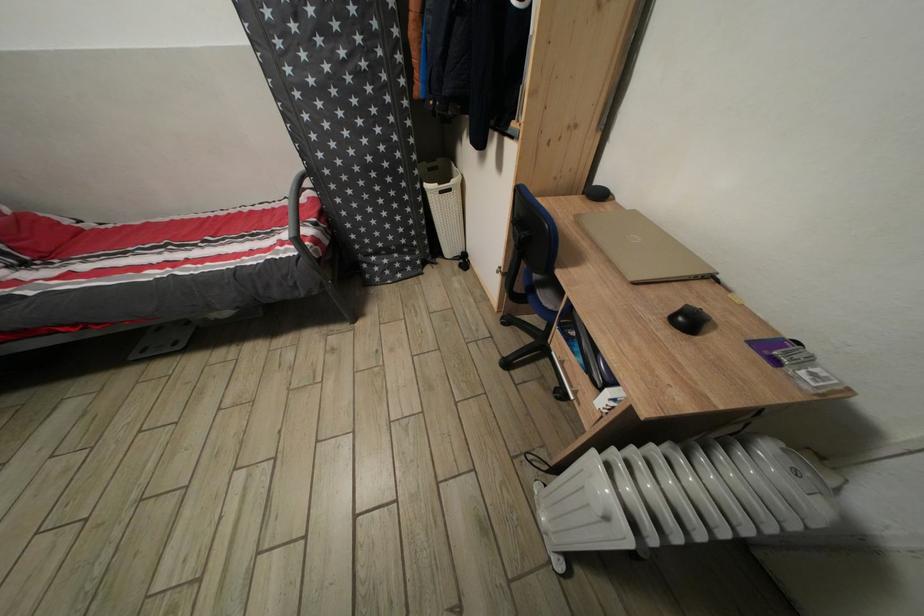
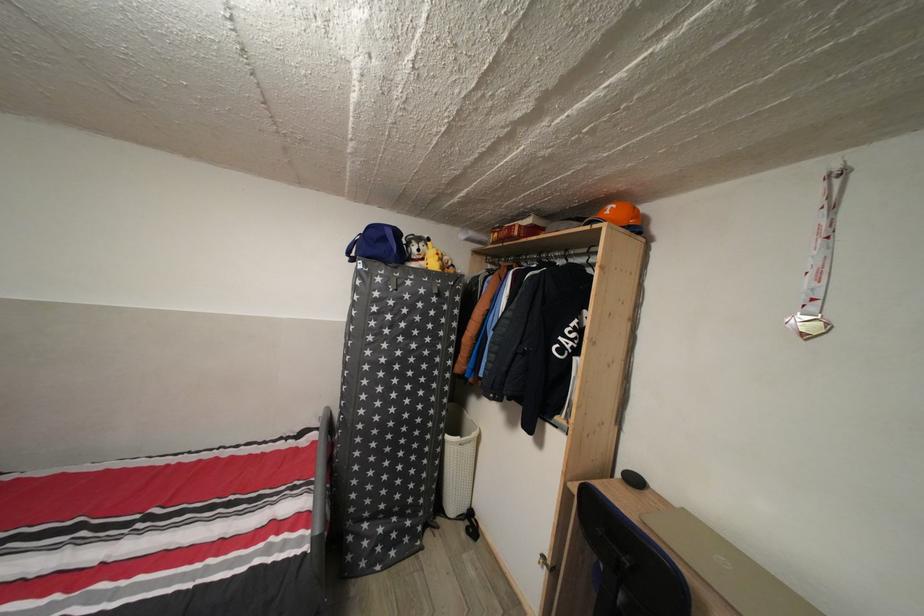
The point at (432,192) is marked in the first image. Where is the corresponding point in the second image?

(455, 444)